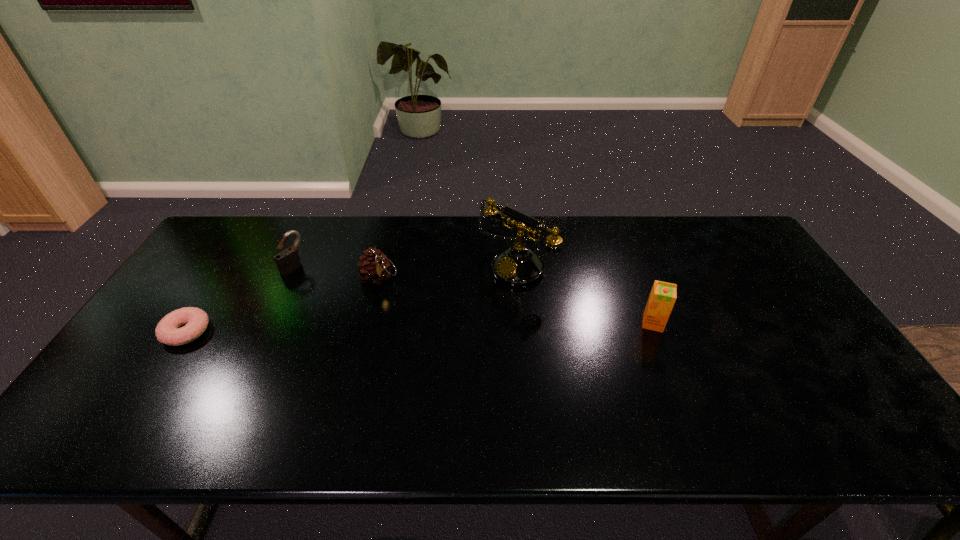
Locate an element on the screen. The height and width of the screenshot is (540, 960). free space located with the keyhole on the front of the second object from left to right is located at coordinates (382, 323).

The image size is (960, 540). What are the coordinates of `free space located 0.380m with the keyhole on the front of the second object from left to right` in the screenshot? It's located at (387, 326).

Image resolution: width=960 pixels, height=540 pixels. In order to click on free spot located with the keyhole on the front of the second object from left to right in this screenshot , I will do `click(374, 318)`.

Locate an element on the screen. The width and height of the screenshot is (960, 540). blank space located 0.200m with a leaf charm attached to the third object from left to right is located at coordinates (423, 327).

This screenshot has height=540, width=960. Identify the location of vacant space positioned with a leaf charm attached to the third object from left to right. (435, 341).

The width and height of the screenshot is (960, 540). Identify the location of vacant space situated with a leaf charm attached to the third object from left to right. (412, 314).

The width and height of the screenshot is (960, 540). I want to click on free space located on the dial of the tallest object, so click(x=461, y=310).

This screenshot has width=960, height=540. In order to click on vacant space situated on the dial of the tallest object in this screenshot , I will do pyautogui.click(x=468, y=305).

At what (x,y) coordinates should I click in order to perform the action: click on vacant space located 0.200m on the dial of the tallest object. Please return your answer as a coordinate pair (x, y). The image size is (960, 540). Looking at the image, I should click on (446, 322).

Image resolution: width=960 pixels, height=540 pixels. Identify the location of object located in the far edge section of the desktop. (517, 266).